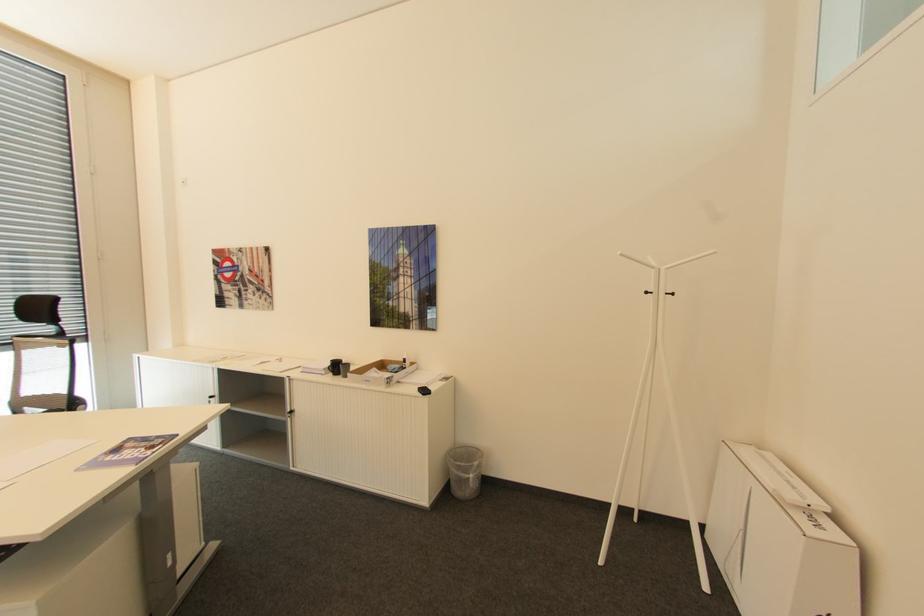
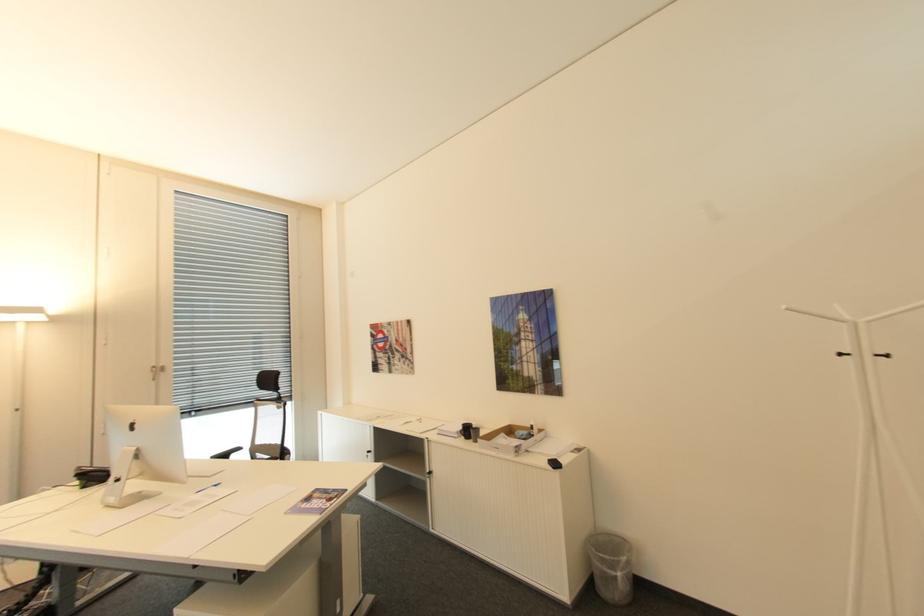
Locate, in the second image, the point that corresponds to (x=56, y=326) in the first image.

(280, 392)